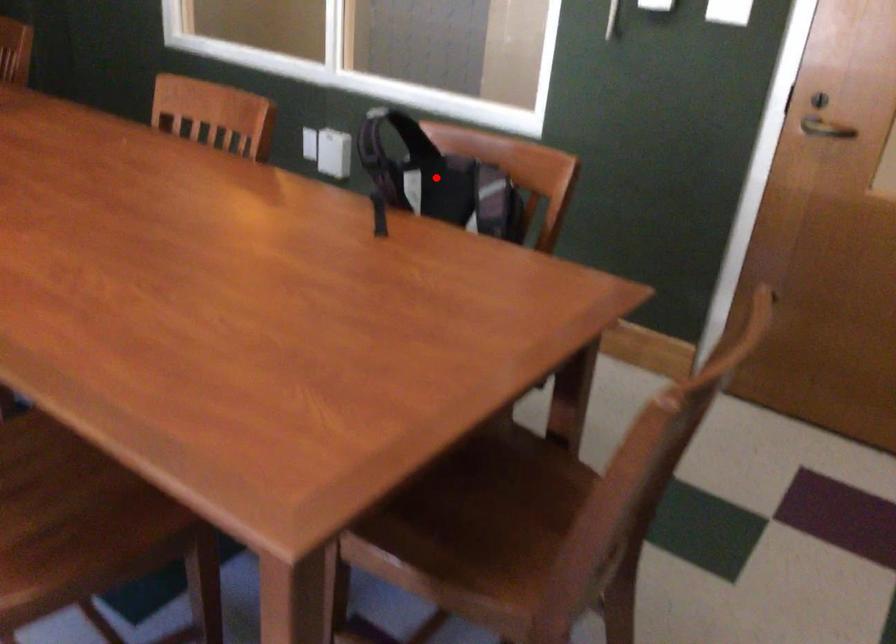
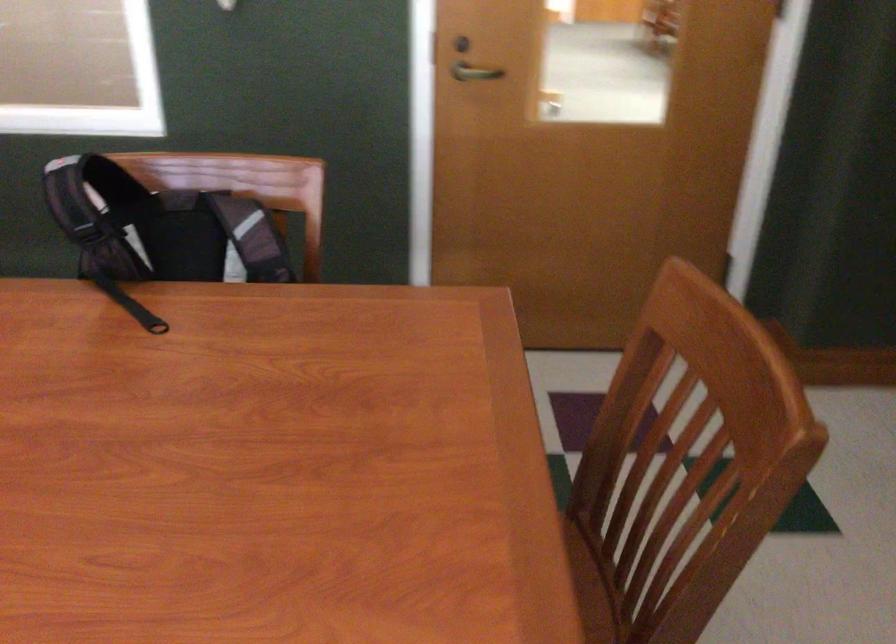
Question: I am providing you with two images of the same scene from different viewpoints. In image1, a red point is highlighted. Considering the same 3D point in image2, which of the following is correct?

Choices:
 (A) It is closer
 (B) It is farther

Answer: (A)